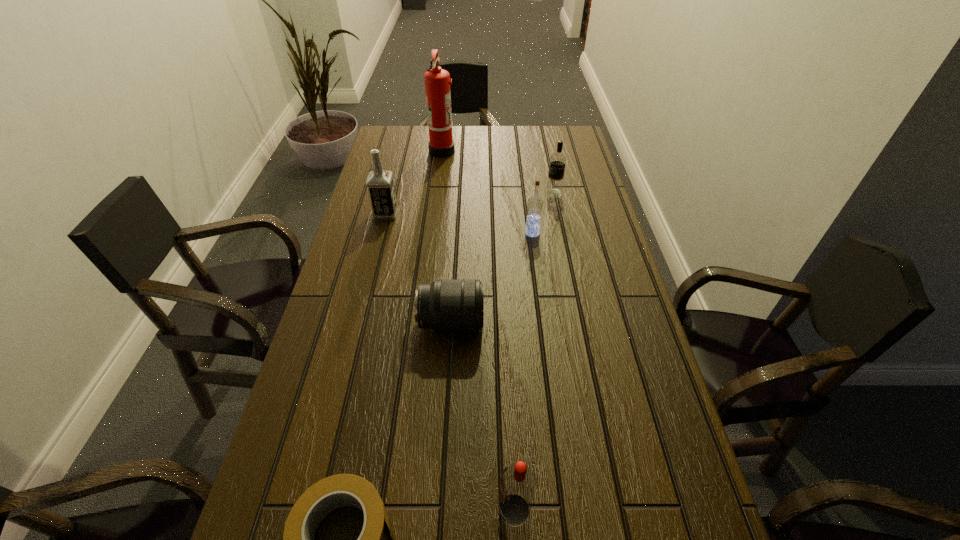
Where is `telephoto lens`? The height and width of the screenshot is (540, 960). telephoto lens is located at coordinates (446, 306).

This screenshot has height=540, width=960. In order to click on the second shortest object in this screenshot , I will do `click(446, 306)`.

Find the location of a particular element. vacant region located 0.360m at the nozzle of the farthest object is located at coordinates (546, 150).

Find the location of a particular element. The image size is (960, 540). vacant space located on the front label of the leftmost vodka is located at coordinates click(455, 213).

Where is `vacant position located on the label of the rightmost vodka`? This screenshot has width=960, height=540. vacant position located on the label of the rightmost vodka is located at coordinates (525, 193).

This screenshot has height=540, width=960. In order to click on vacant space situated 0.100m on the label of the rightmost vodka in this screenshot , I will do `click(516, 193)`.

Find the location of a particular element. free space located on the label of the rightmost vodka is located at coordinates (473, 193).

The height and width of the screenshot is (540, 960). I want to click on free location located on the right of the second object from right to left, so click(x=572, y=233).

This screenshot has height=540, width=960. In order to click on vacant point located on the front label of the second vodka from left to right in this screenshot , I will do `click(368, 510)`.

Where is `free space located 0.240m on the front label of the second vodka from left to right`? The width and height of the screenshot is (960, 540). free space located 0.240m on the front label of the second vodka from left to right is located at coordinates [x=368, y=510].